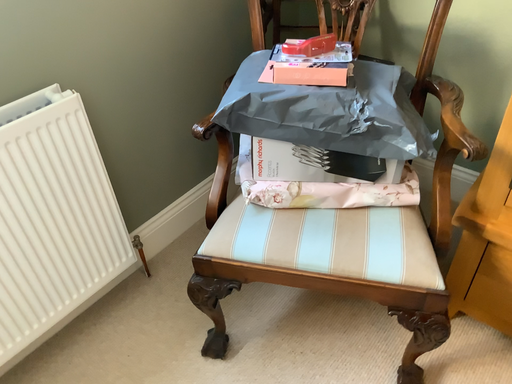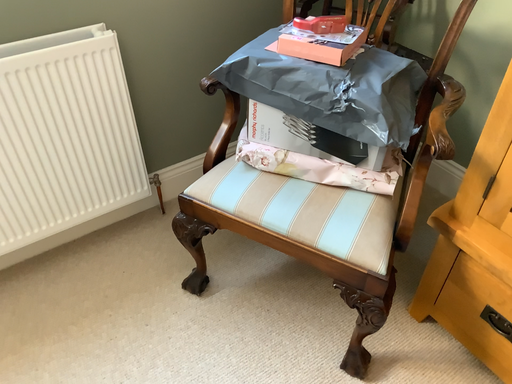
Question: Which way did the camera rotate in the video?

Choices:
 (A) rotated left
 (B) rotated right

Answer: (A)